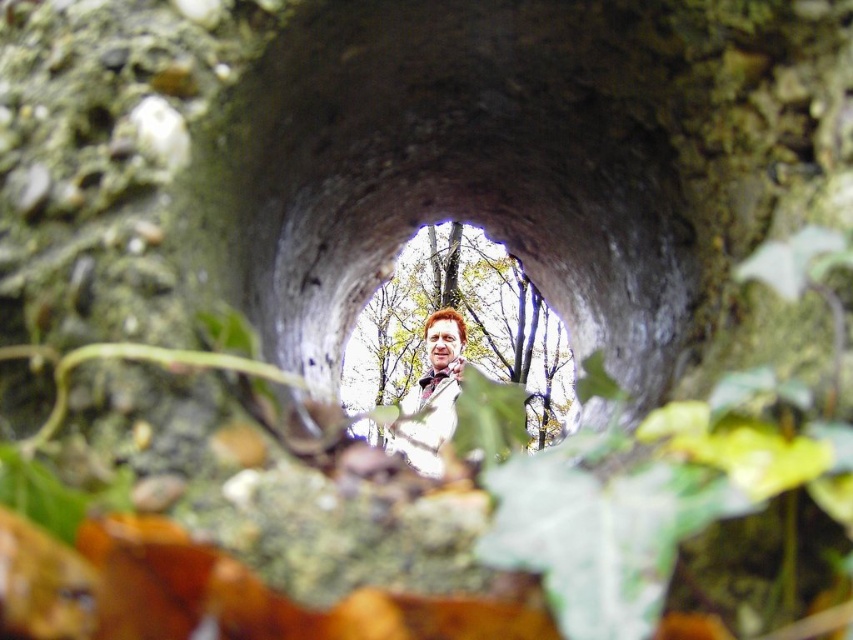
Which is below, smooth concrete hole at center or light brown leather jacket at center?

light brown leather jacket at center

Is smooth concrete hole at center positioned before light brown leather jacket at center?

No, it is behind light brown leather jacket at center.

Is point (543, 417) positioned after point (433, 445)?

Yes, point (543, 417) is behind point (433, 445).

Locate an element on the screen. smooth concrete hole at center is located at coordinates (456, 342).